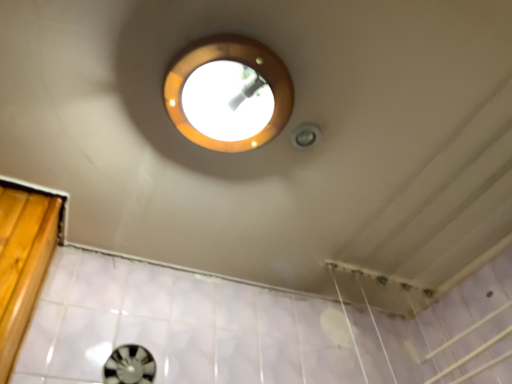
Question: From a real-world perspective, is matte gold light fixture at upper center physically located above or below black plastic porthole at lower left?

Choices:
 (A) below
 (B) above

Answer: (B)

Question: In terms of size, does matte gold light fixture at upper center appear bigger or smaller than black plastic porthole at lower left?

Choices:
 (A) small
 (B) big

Answer: (B)

Question: Considering the relative positions of matte gold light fixture at upper center and black plastic porthole at lower left in the image provided, is matte gold light fixture at upper center to the left or to the right of black plastic porthole at lower left?

Choices:
 (A) right
 (B) left

Answer: (A)

Question: Is black plastic porthole at lower left inside the boundaries of matte gold light fixture at upper center, or outside?

Choices:
 (A) inside
 (B) outside

Answer: (B)

Question: In terms of size, does black plastic porthole at lower left appear bigger or smaller than matte gold light fixture at upper center?

Choices:
 (A) small
 (B) big

Answer: (A)

Question: Relative to matte gold light fixture at upper center, is black plastic porthole at lower left in front or behind?

Choices:
 (A) front
 (B) behind

Answer: (B)

Question: From a real-world perspective, relative to matte gold light fixture at upper center, is black plastic porthole at lower left vertically above or below?

Choices:
 (A) below
 (B) above

Answer: (A)